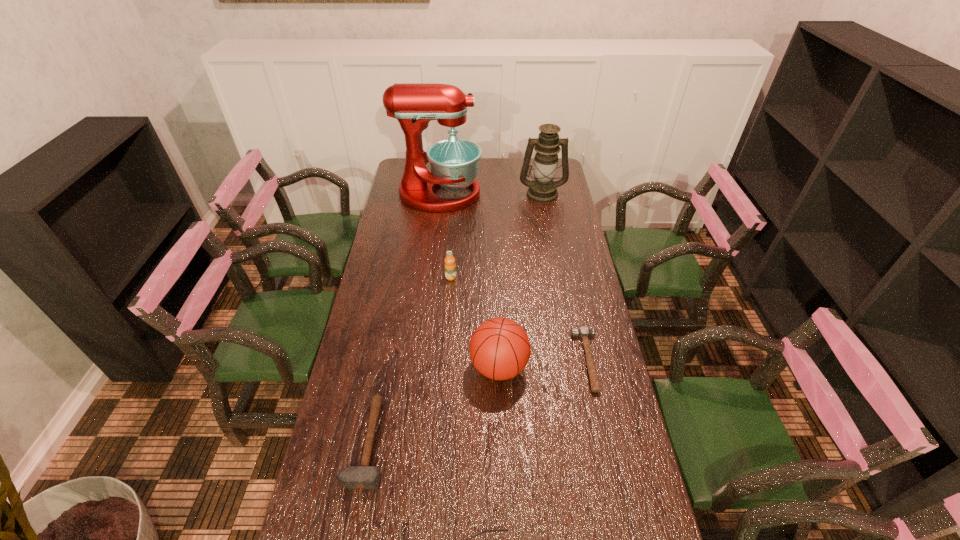
Image resolution: width=960 pixels, height=540 pixels. What are the coordinates of `oil lamp at the right edge` in the screenshot? It's located at click(542, 189).

At what (x,y) coordinates should I click in order to perform the action: click on hammer located in the right edge section of the desktop. Please return your answer as a coordinate pair (x, y). The image size is (960, 540). Looking at the image, I should click on (583, 332).

Find the location of a particular element. This screenshot has height=540, width=960. object that is positioned at the far left corner is located at coordinates (454, 162).

Locate an element on the screen. vacant area at the far edge is located at coordinates (516, 177).

Locate an element on the screen. The image size is (960, 540). vacant area at the left edge is located at coordinates (391, 303).

Locate an element on the screen. The height and width of the screenshot is (540, 960). vacant region at the right edge is located at coordinates (565, 376).

Find the location of a particular element. The height and width of the screenshot is (540, 960). vacant point located between the third shortest object and the second tallest object is located at coordinates (455, 318).

Locate an element on the screen. Image resolution: width=960 pixels, height=540 pixels. free space between the fifth shortest object and the left hammer is located at coordinates (433, 405).

The image size is (960, 540). I want to click on free space between the sixth farthest object and the sixth shortest object, so click(455, 318).

Locate an element on the screen. This screenshot has width=960, height=540. free space between the shorter hammer and the basketball is located at coordinates (543, 364).